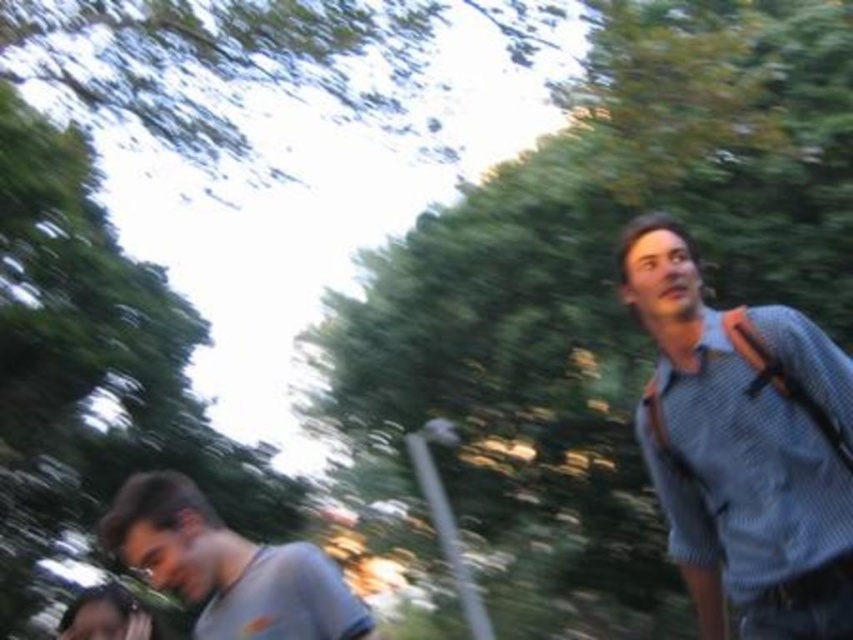
Who is shorter, textured blue shirt at right or gray cotton shirt at lower left?

With less height is gray cotton shirt at lower left.

Describe the element at coordinates (744, 445) in the screenshot. I see `textured blue shirt at right` at that location.

Who is more forward, (802, 492) or (183, 502)?

Point (802, 492)

This screenshot has width=853, height=640. Identify the location of textured blue shirt at right. (744, 445).